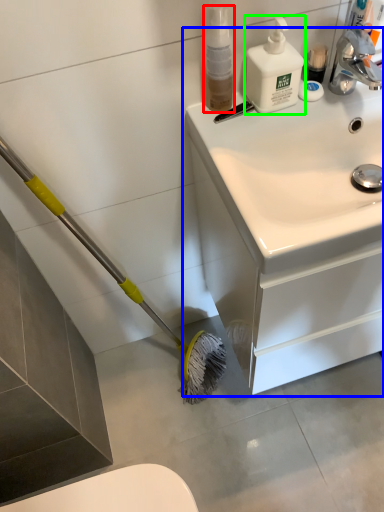
Question: Based on their relative distances, which object is nearer to cleaning product (highlighted by a red box)? Choose from bathroom cabinet (highlighted by a blue box) and cleaning product (highlighted by a green box).

Choices:
 (A) bathroom cabinet
 (B) cleaning product

Answer: (B)